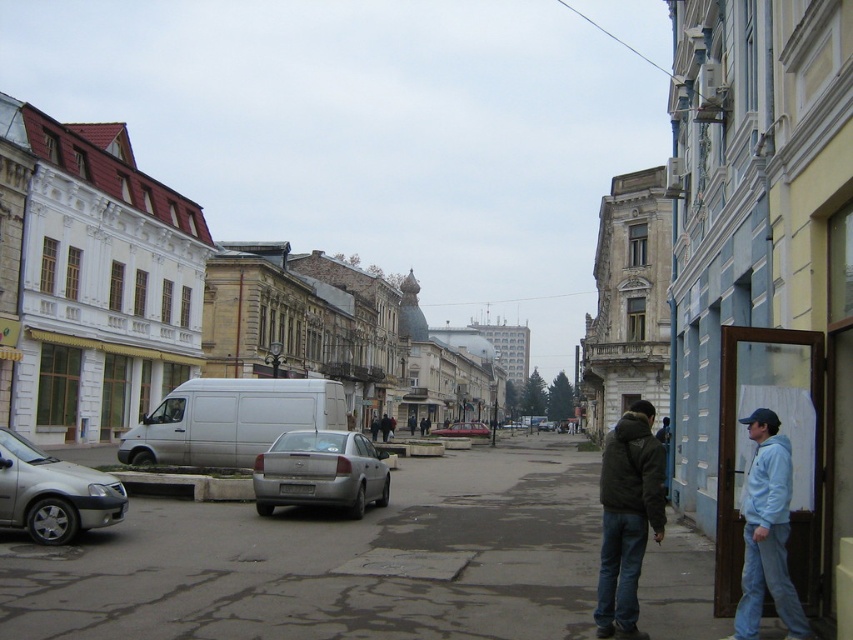
Who is taller, silver metallic sedan at lower left or matte silver sedan at center?

matte silver sedan at center is taller.

How far apart are silver metallic sedan at lower left and matte silver sedan at center?

They are 88.23 meters apart.

What do you see at coordinates (53, 493) in the screenshot? Image resolution: width=853 pixels, height=640 pixels. I see `silver metallic sedan at lower left` at bounding box center [53, 493].

I want to click on silver metallic sedan at lower left, so click(x=53, y=493).

I want to click on light blue hoodie at lower right, so click(767, 532).

Between point (753, 497) and point (390, 419), which one is positioned in front?

Point (753, 497)

Where is `light blue hoodie at lower right`? light blue hoodie at lower right is located at coordinates (767, 532).

Locate an element on the screen. This screenshot has width=853, height=640. light blue hoodie at lower right is located at coordinates point(767,532).

Does dark brown leather jacket at lower right appear on the left side of silver metallic sedan at lower left?

In fact, dark brown leather jacket at lower right is to the right of silver metallic sedan at lower left.

Does point (643, 536) come farther from viewer compared to point (109, 484)?

That is False.

Image resolution: width=853 pixels, height=640 pixels. I want to click on dark brown leather jacket at lower right, so click(627, 516).

Image resolution: width=853 pixels, height=640 pixels. Find the location of `dark brown leather jacket at lower right`. dark brown leather jacket at lower right is located at coordinates (627, 516).